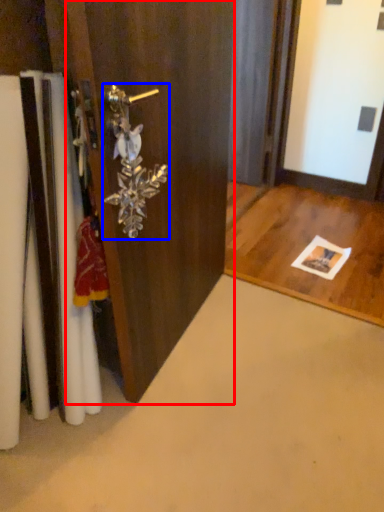
Question: Which point is further to the camera, door (highlighted by a red box) or door handle (highlighted by a blue box)?

Choices:
 (A) door
 (B) door handle

Answer: (B)